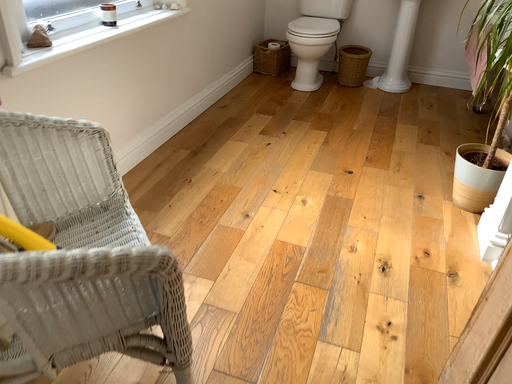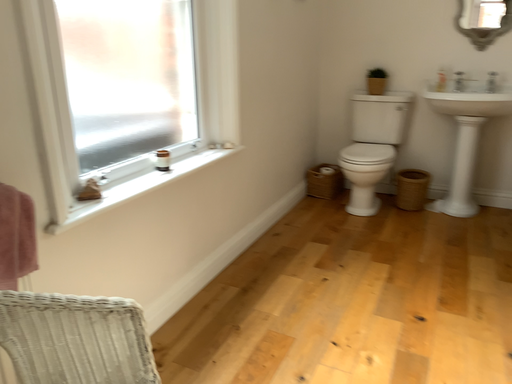
Question: Which way did the camera rotate in the video?

Choices:
 (A) rotated downward
 (B) rotated upward

Answer: (B)